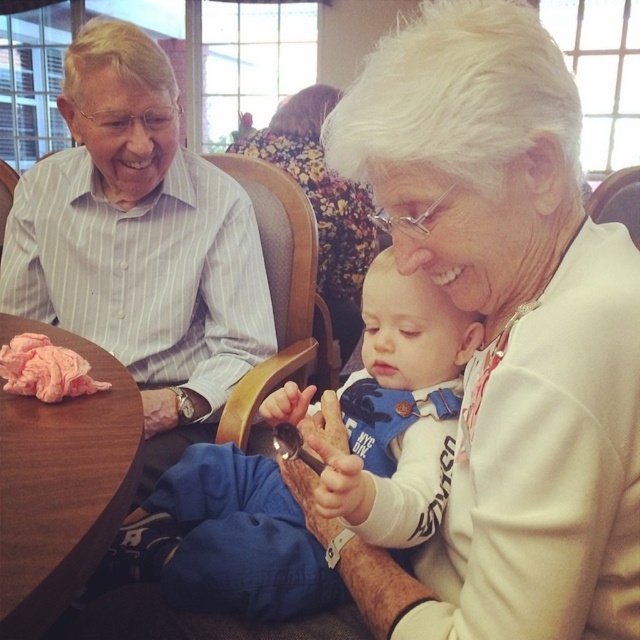
Does wooden table at lower left have a greater height compared to pink fabric at table left?

Yes.

Which is more to the right, wooden table at lower left or pink fabric at table left?

From the viewer's perspective, wooden table at lower left appears more on the right side.

Locate an element on the screen. wooden table at lower left is located at coordinates (60, 484).

From the picture: Does wooden armchair at center come in front of pink fabric at table left?

No, wooden armchair at center is behind pink fabric at table left.

Where is `wooden armchair at center`? This screenshot has width=640, height=640. wooden armchair at center is located at coordinates (280, 291).

Is white soft baby at center positioned before wooden table at lower left?

No, white soft baby at center is behind wooden table at lower left.

Can you confirm if white soft baby at center is shorter than wooden table at lower left?

Incorrect, white soft baby at center's height does not fall short of wooden table at lower left's.

Who is more forward, (348, 380) or (125, 426)?

Positioned in front is point (125, 426).

Find the location of `white soft baby at center`. white soft baby at center is located at coordinates (403, 406).